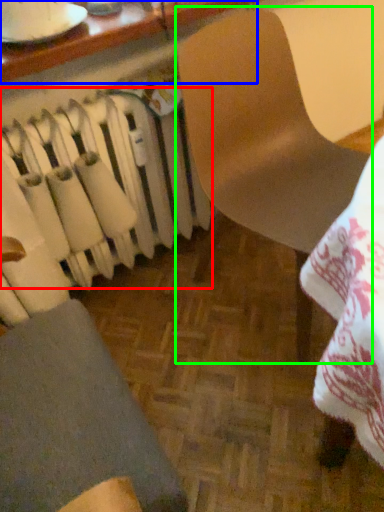
Question: Considering the real-world distances, which object is farthest from radiator (highlighted by a red box)? table (highlighted by a blue box) or chair (highlighted by a green box)?

Choices:
 (A) table
 (B) chair

Answer: (A)